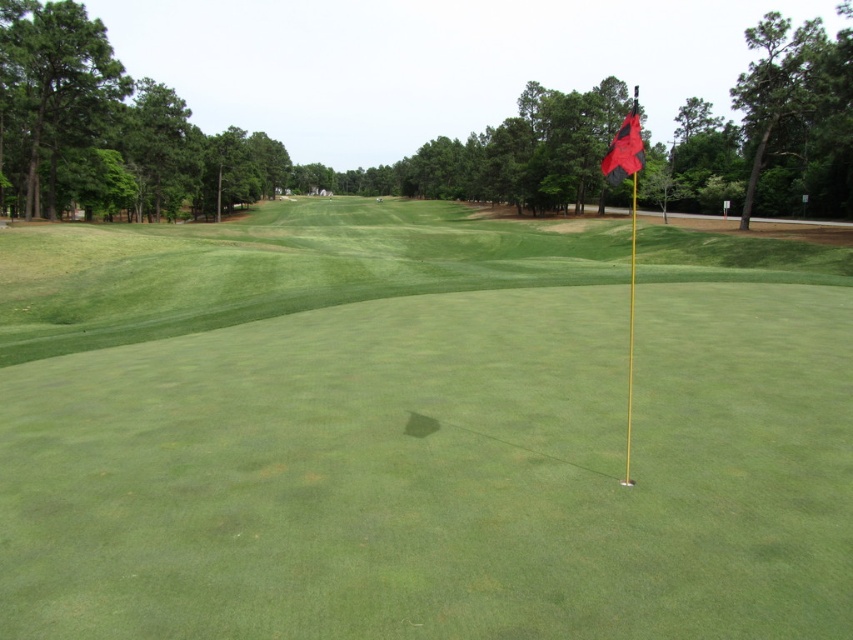
Is green grass at center taller than red fabric flag at upper right?

Yes.

Which is in front, point (575, 605) or point (630, 161)?

Point (575, 605) is more forward.

At what (x,y) coordinates should I click in order to perform the action: click on green grass at center. Please return your answer as a coordinate pair (x, y). Looking at the image, I should click on (421, 429).